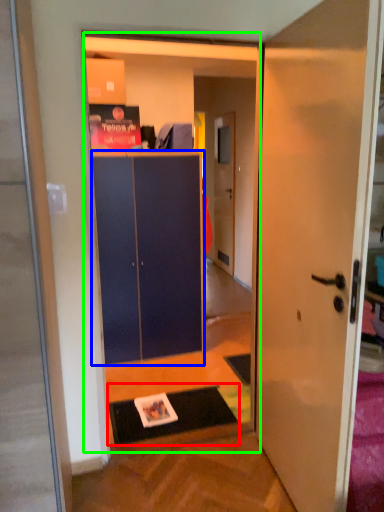
Question: Which object is the farthest from doormat (highlighted by a red box)? Choose among these: cabinetry (highlighted by a blue box) or bookstore (highlighted by a green box).

Choices:
 (A) cabinetry
 (B) bookstore

Answer: (B)